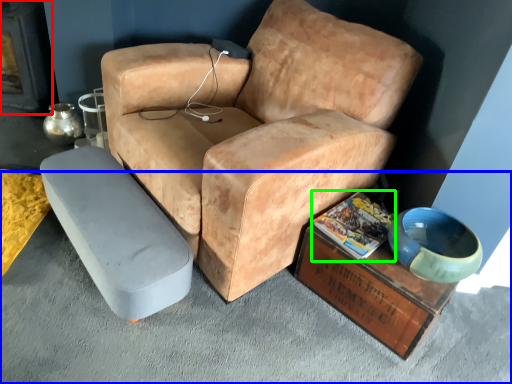
Question: Based on their relative distances, which object is nearer to fireplace (highlighted by a red box)? Choose from concrete (highlighted by a blue box) and magazine (highlighted by a green box).

Choices:
 (A) concrete
 (B) magazine

Answer: (A)